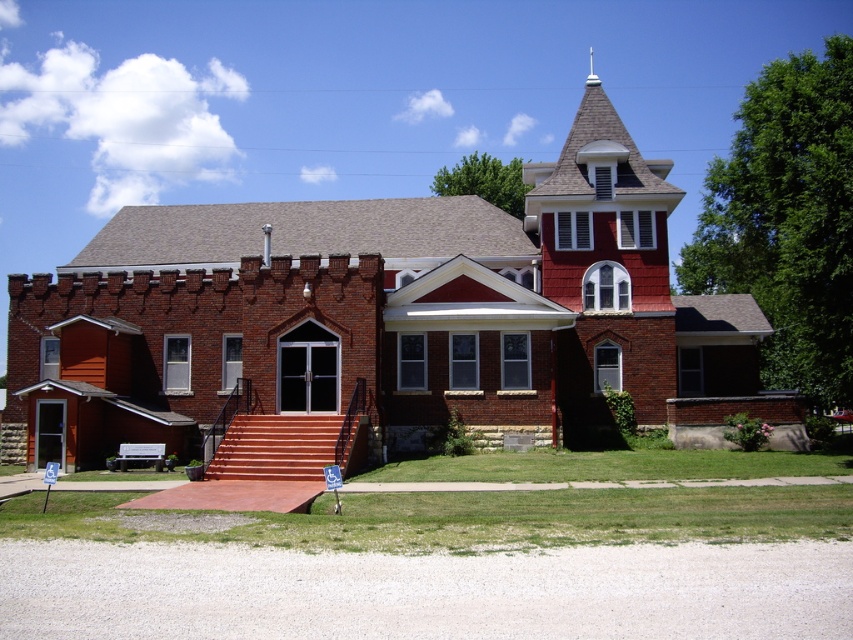
Does point (548, 385) come closer to viewer compared to point (602, 112)?

Yes, it is in front of point (602, 112).

Which of these two, red brick church at center or shiny copper spire at upper center, stands taller?

shiny copper spire at upper center

Who is more forward, [544,266] or [577,230]?

Point [544,266]

The width and height of the screenshot is (853, 640). Identify the location of red brick church at center. (381, 317).